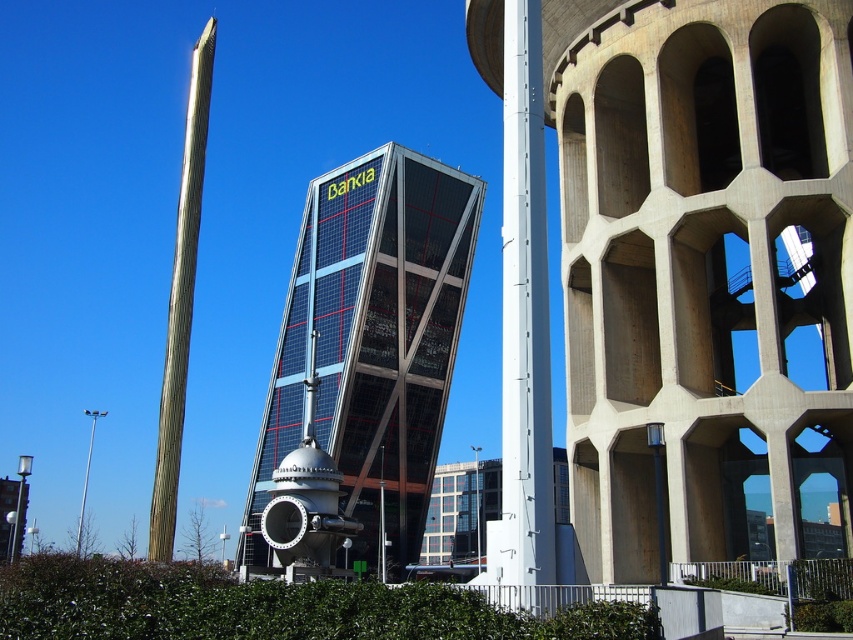
You are a GUI agent. You are given a task and a screenshot of the screen. Output one action in this format:
    pyautogui.click(x=<x>, y=<y>)
    Task: Click on the green leafy hedge at lower center
    The width and height of the screenshot is (853, 640).
    Given the screenshot: What is the action you would take?
    pyautogui.click(x=271, y=608)

Locate an element on the screen. This screenshot has height=640, width=853. green leafy hedge at lower center is located at coordinates (271, 608).

This screenshot has height=640, width=853. In order to click on green leafy hedge at lower center in this screenshot , I will do `click(271, 608)`.

Describe the element at coordinates (370, 339) in the screenshot. This screenshot has height=640, width=853. I see `glassy steel skyscraper at center` at that location.

Who is positioned more to the right, glassy steel skyscraper at center or green leafy hedge at lower center?

green leafy hedge at lower center is more to the right.

Is point (351, 429) closer to camera compared to point (283, 632)?

No, (351, 429) is behind (283, 632).

Locate an element on the screen. glassy steel skyscraper at center is located at coordinates (370, 339).

Is concrete at center bigger than green leafy hedge at lower center?

Yes, concrete at center is bigger than green leafy hedge at lower center.

Does concrete at center have a lesser width compared to green leafy hedge at lower center?

Incorrect, concrete at center's width is not less than green leafy hedge at lower center's.

Is point (845, 208) farther from viewer compared to point (602, 611)?

Yes, it is.

Find the location of a particular element. This screenshot has height=640, width=853. concrete at center is located at coordinates (701, 266).